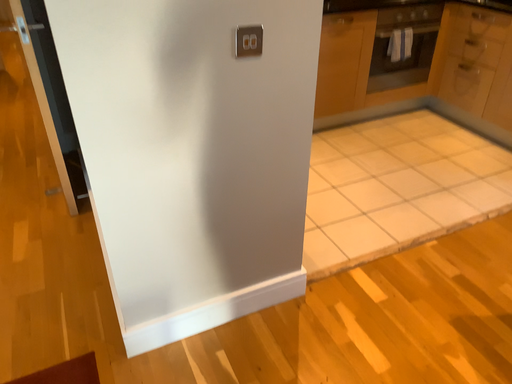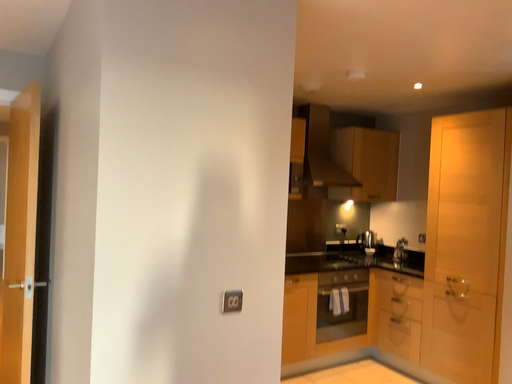
Question: How did the camera likely rotate when shooting the video?

Choices:
 (A) rotated right
 (B) rotated left

Answer: (A)